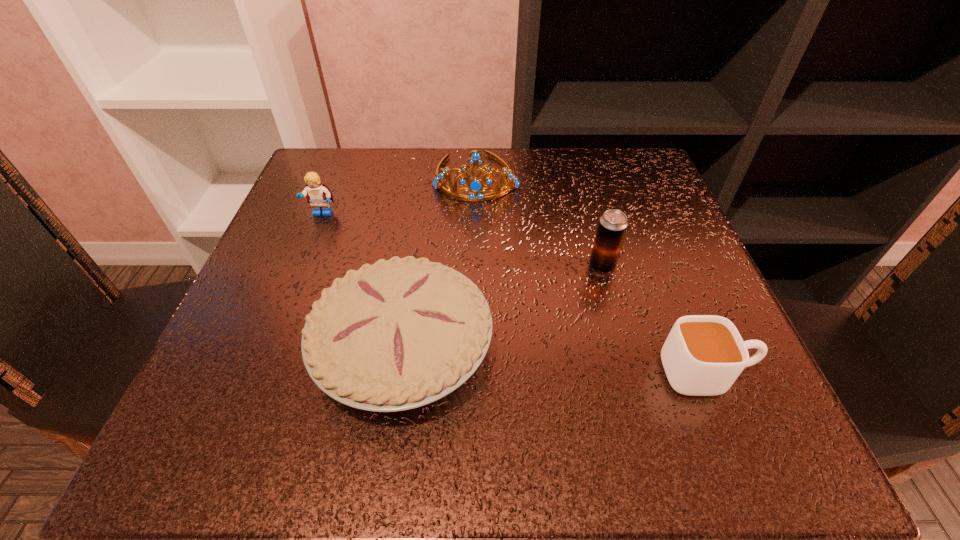
Where is `vacant region located 0.240m on the back of the pie`? The width and height of the screenshot is (960, 540). vacant region located 0.240m on the back of the pie is located at coordinates (425, 199).

At what (x,y) coordinates should I click in order to perform the action: click on tiara located in the far edge section of the desktop. Please return your answer as a coordinate pair (x, y). The width and height of the screenshot is (960, 540). Looking at the image, I should click on (475, 186).

You are a GUI agent. You are given a task and a screenshot of the screen. Output one action in this format:
    pyautogui.click(x=<x>, y=<y>)
    Task: Click on the Lego at the far edge
    
    Given the screenshot: What is the action you would take?
    pyautogui.click(x=318, y=195)

The width and height of the screenshot is (960, 540). Identify the location of pie at the near edge. (402, 333).

I want to click on cup positioned at the near edge, so click(703, 355).

Locate an element on the screen. Lego that is positioned at the left edge is located at coordinates [x=318, y=195].

I want to click on pie that is at the left edge, so click(x=402, y=333).

The height and width of the screenshot is (540, 960). I want to click on beer can situated at the right edge, so click(613, 224).

Where is `cup that is positioned at the right edge`? This screenshot has height=540, width=960. cup that is positioned at the right edge is located at coordinates click(x=703, y=355).

This screenshot has height=540, width=960. Identify the location of object that is at the far left corner. (318, 195).